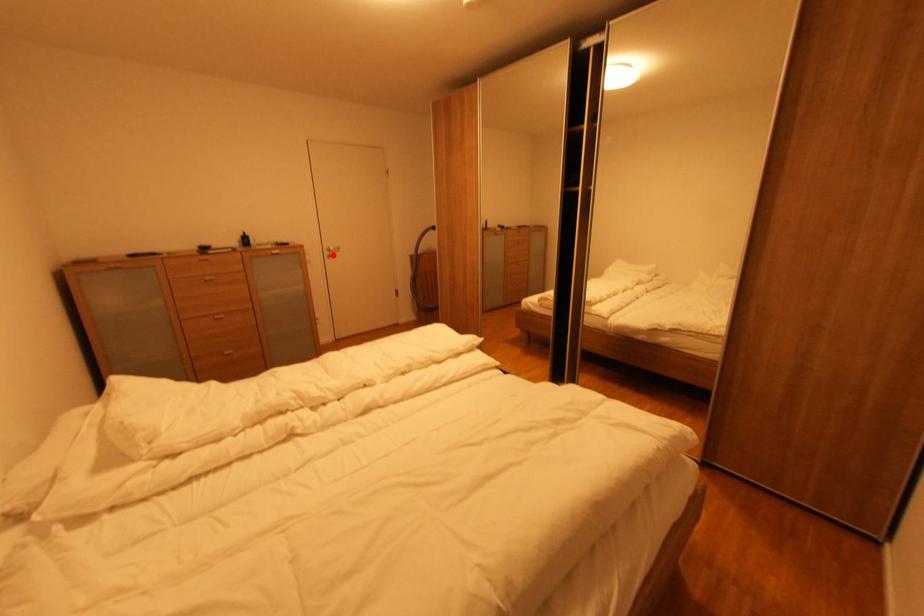
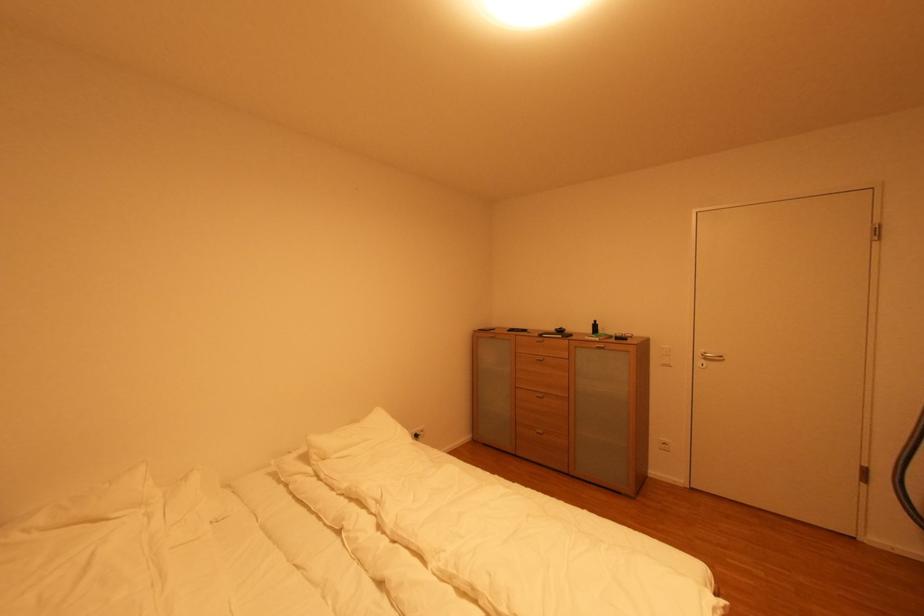
In the second image, find the point that corresponds to the highlighted location in the first image.

(706, 362)